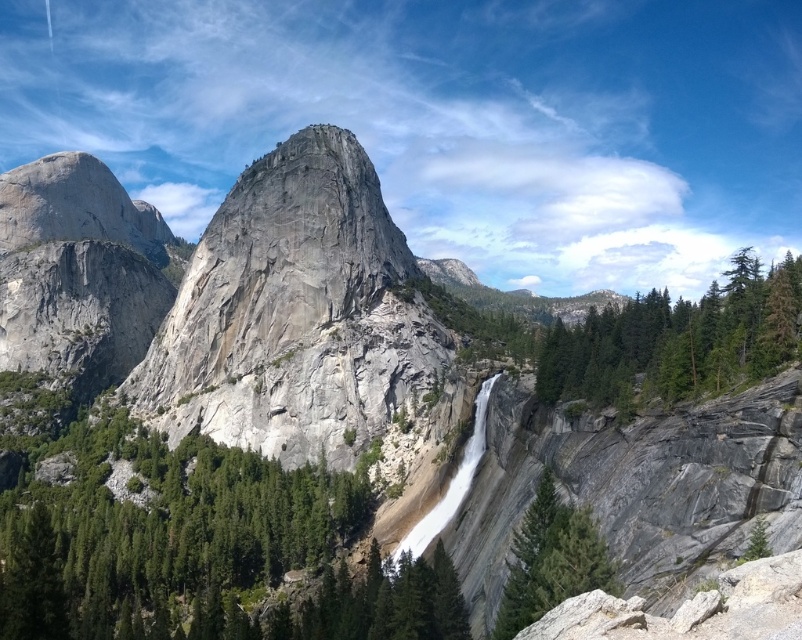
Question: Estimate the real-world distances between objects in this image. Which object is farther from the green textured rock at center?

Choices:
 (A) green textured tree at right
 (B) green textured rock at lower right

Answer: (A)

Question: Can you confirm if green textured rock at center is positioned above green textured rock at lower right?

Choices:
 (A) yes
 (B) no

Answer: (B)

Question: From the image, what is the correct spatial relationship of green textured rock at center in relation to green textured tree at right?

Choices:
 (A) right
 (B) left

Answer: (B)

Question: Can you confirm if green textured tree at right is positioned to the left of green textured rock at lower right?

Choices:
 (A) yes
 (B) no

Answer: (B)

Question: Which of the following is the closest to the observer?

Choices:
 (A) (525, 547)
 (B) (27, 500)
 (C) (732, 278)

Answer: (A)

Question: Considering the real-world distances, which object is closest to the green textured rock at center?

Choices:
 (A) green textured rock at lower right
 (B) green textured tree at right

Answer: (A)